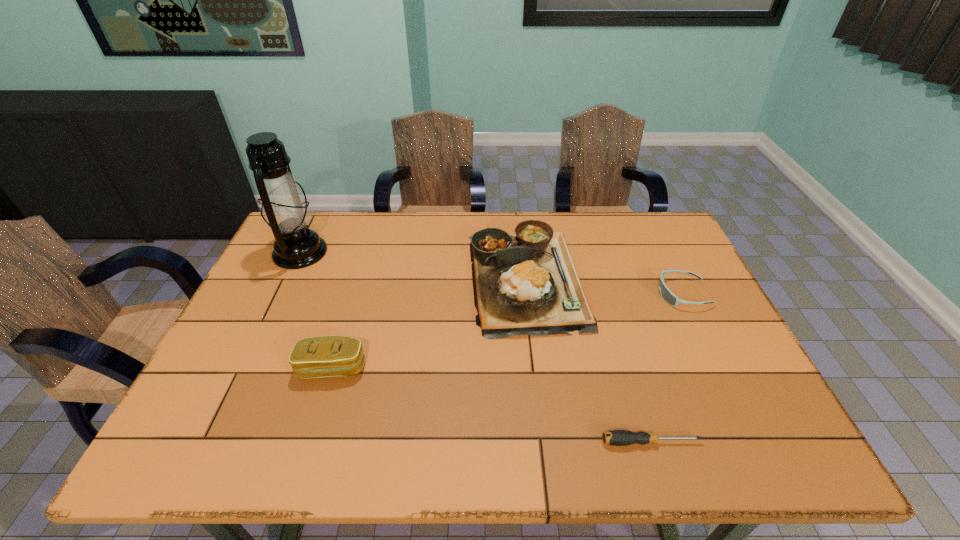
I want to click on vacant region located 0.180m on the right of the platter, so click(x=644, y=279).

Find the location of `free spot located on the zipper side of the second nearest object`. free spot located on the zipper side of the second nearest object is located at coordinates (306, 454).

This screenshot has width=960, height=540. Identify the location of vacant area situated on the front-facing side of the goggles. (591, 294).

You are a GUI agent. You are given a task and a screenshot of the screen. Output one action in this format:
    pyautogui.click(x=<x>, y=<y>)
    Task: Click on the vacant region located on the front-facing side of the goggles
    The width and height of the screenshot is (960, 540).
    Given the screenshot: What is the action you would take?
    pyautogui.click(x=609, y=294)

Identify the location of vacant space located 0.340m on the front-facing side of the goggles. (539, 294).

The image size is (960, 540). I want to click on free space located on the back of the screwdriver, so click(621, 344).

This screenshot has width=960, height=540. In order to click on oil lamp that is at the far edge in this screenshot , I will do `click(285, 210)`.

Find the location of a particular element. The image size is (960, 540). platter that is at the far edge is located at coordinates (526, 283).

Locate an element on the screen. object located in the near edge section of the desktop is located at coordinates (615, 437).

The width and height of the screenshot is (960, 540). I want to click on object located in the left edge section of the desktop, so click(x=285, y=210).